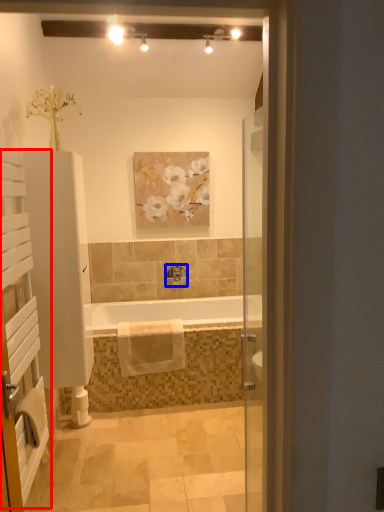
Question: Which of the following is the farthest to the observer, screen door (highlighted by a red box) or tap (highlighted by a blue box)?

Choices:
 (A) screen door
 (B) tap

Answer: (B)